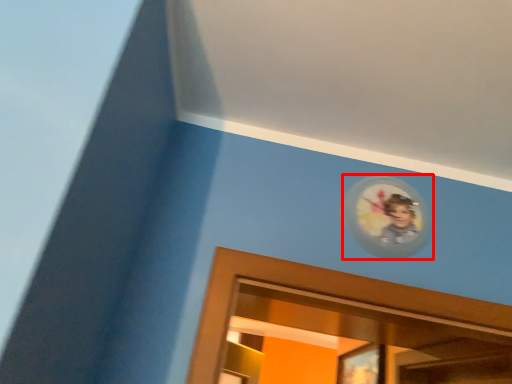
Question: Where is picture frame (annotated by the red box) located in relation to portrait in the image?

Choices:
 (A) right
 (B) left

Answer: (B)